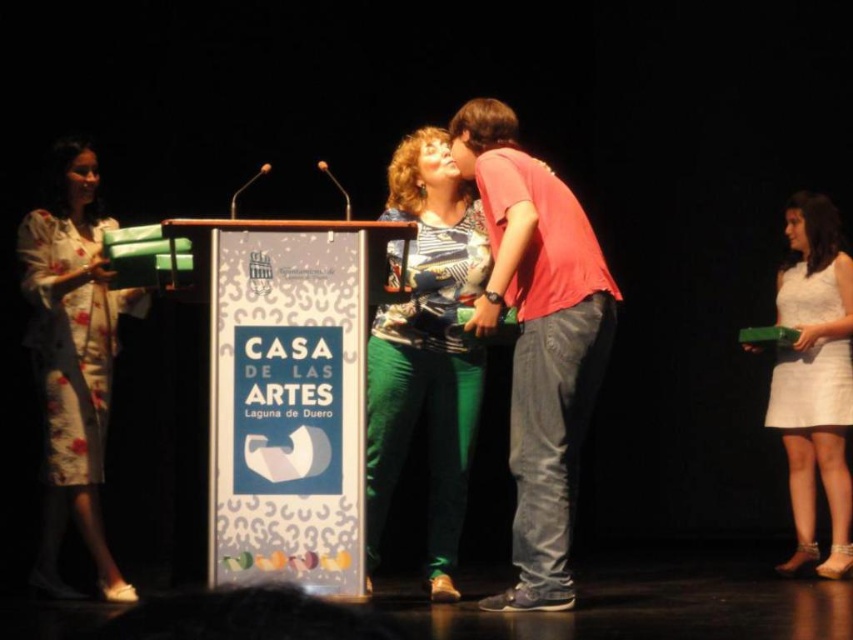
Question: Which object is farther from the camera taking this photo?

Choices:
 (A) printed fabric blouse at center
 (B) white satin dress at lower right

Answer: (B)

Question: Which object is positioned farthest from the floral silk dress at left?

Choices:
 (A) pink cotton shirt at center
 (B) white satin dress at lower right

Answer: (B)

Question: Does pink cotton shirt at center appear on the left side of white satin dress at lower right?

Choices:
 (A) no
 (B) yes

Answer: (B)

Question: In this image, where is pink cotton shirt at center located relative to white satin dress at lower right?

Choices:
 (A) below
 (B) above

Answer: (B)

Question: Which object is farther from the camera taking this photo?

Choices:
 (A) white satin dress at lower right
 (B) pink cotton shirt at center
 (C) floral silk dress at left

Answer: (A)

Question: Does pink cotton shirt at center have a greater width compared to white satin dress at lower right?

Choices:
 (A) yes
 (B) no

Answer: (A)